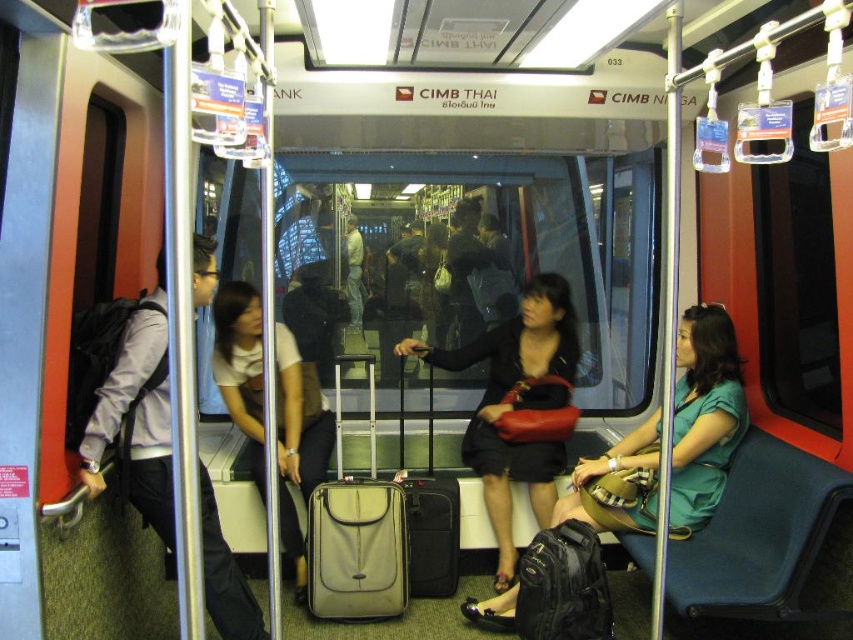
Does beige fabric suitcase at center have a smaller size compared to matte gray suitcase at center?

No.

Where is `beige fabric suitcase at center`? beige fabric suitcase at center is located at coordinates (357, 534).

Between point (144, 376) and point (550, 296), which one is positioned in front?

Point (144, 376)

Does matte black backpack at left have a smaller size compared to matte black jacket at center?

No, matte black backpack at left is not smaller than matte black jacket at center.

In order to click on matte black backpack at left in this screenshot , I will do `click(137, 413)`.

How far apart are matte black backpack at left and white matte suitcase at center?

25.31 inches

Where is `matte black backpack at left`? This screenshot has height=640, width=853. matte black backpack at left is located at coordinates (137, 413).

Where is `matte black backpack at left`? matte black backpack at left is located at coordinates (137, 413).